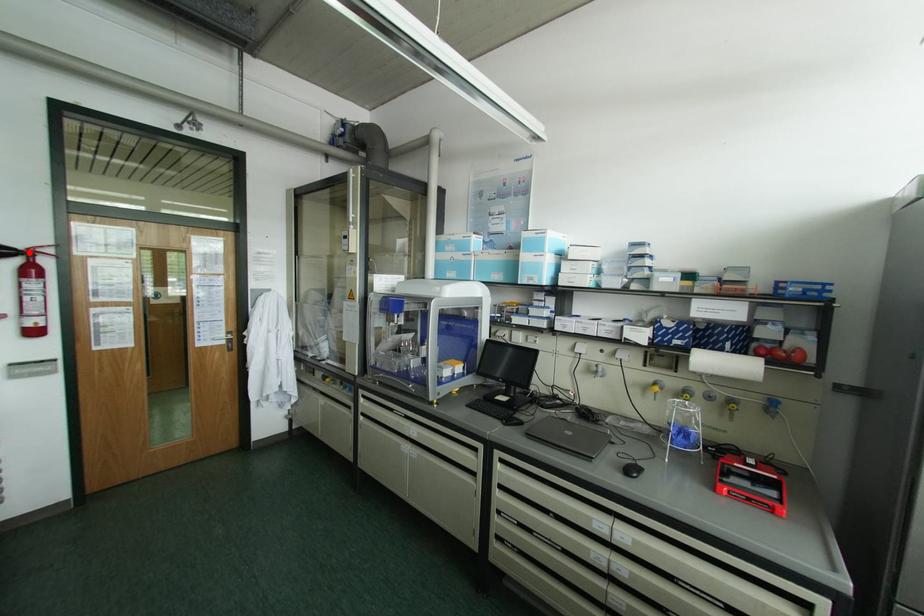
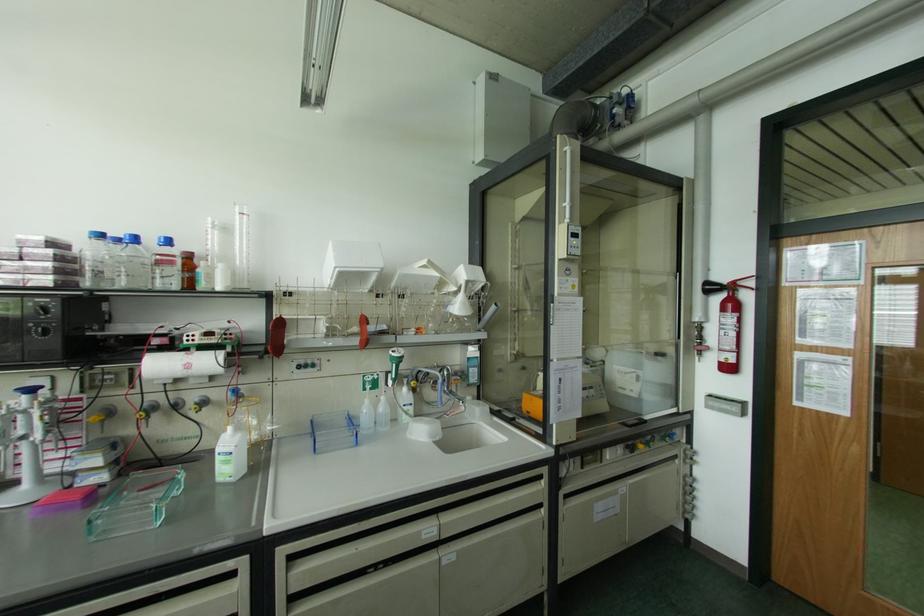
The point at the highlighted location is marked in the first image. Where is the corresponding point in the second image?

(732, 286)